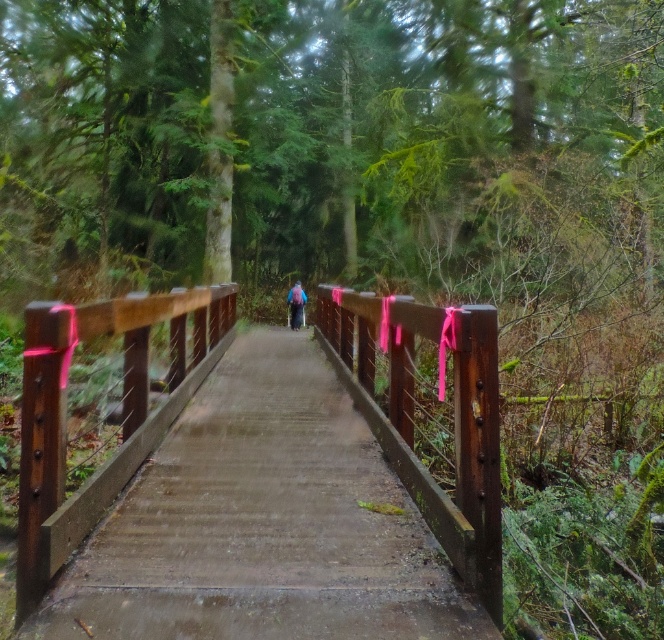
You are a hiker carrying a backpack weighing 20 kilograms. You need to cross the rustic wood bridge at center. Considering the bridge is 3.81 meters away from you, can you safely reach it without slipping?

The rustic wood bridge at center is 3.81 meters away, so yes, you can safely reach it. The distance is manageable for a hiker with a 20 kg backpack, and the bridge appears wet but the description does not mention slippery conditions beyond dampness, so proceed with caution.

You are standing at the entrance of the forest and want to cross the rustic wood bridge at center. Based on the coordinates provided, in which direction should you head relative to your current position?

The rustic wood bridge at center is located at coordinates point (122, 416), so you should head towards the direction where the x and y coordinates increase to reach it.

You are a hiker who wants to cross the rustic wood bridge at center while carrying your purple fabric backpack at center. Will the bridge allow you to pass underneath it without removing the backpack?

The rustic wood bridge at center is not as tall as the purple fabric backpack at center, so the bridge may not provide enough clearance for you to pass underneath it without removing the backpack.